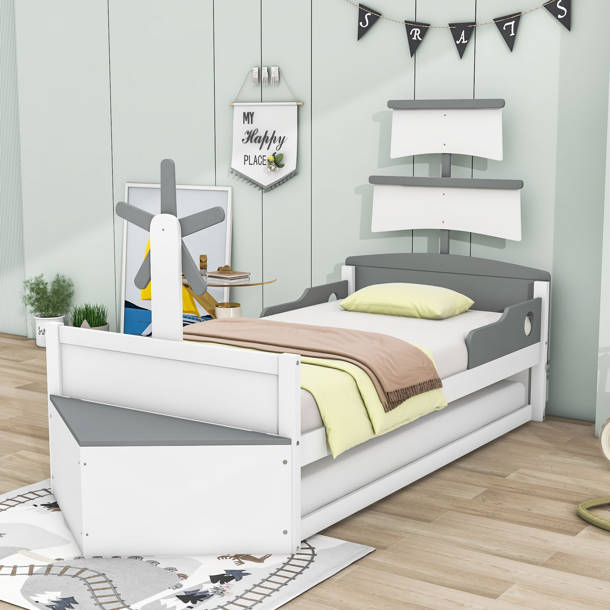
Find the location of a particular element. The width and height of the screenshot is (610, 610). bed is located at coordinates (438, 340).